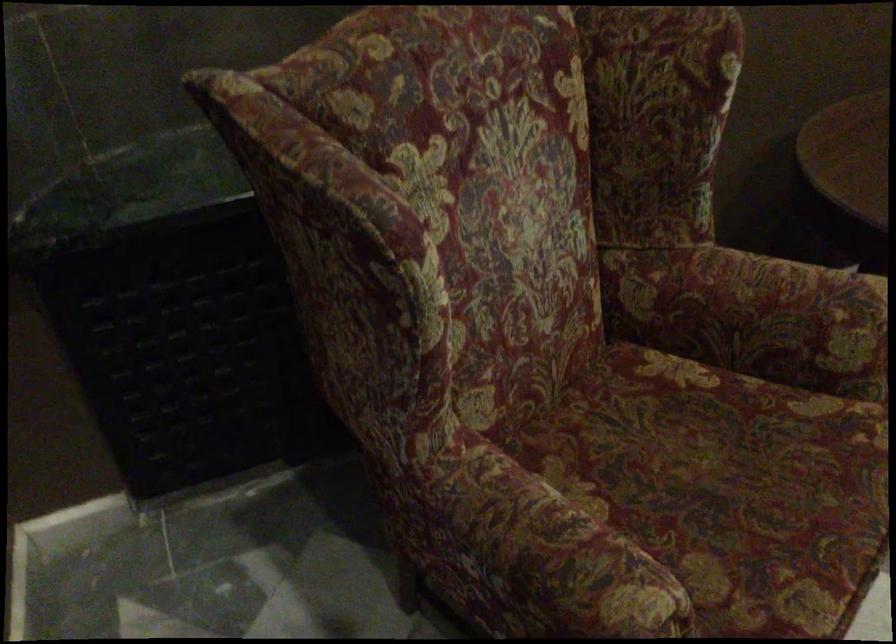
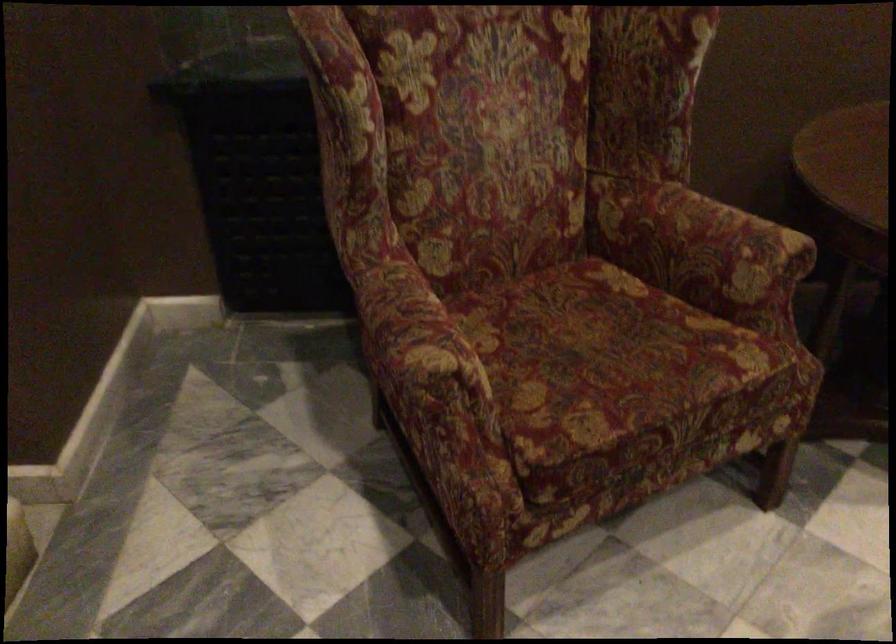
Find the pixel in the second image that matches (x=772, y=310) in the first image.

(700, 243)